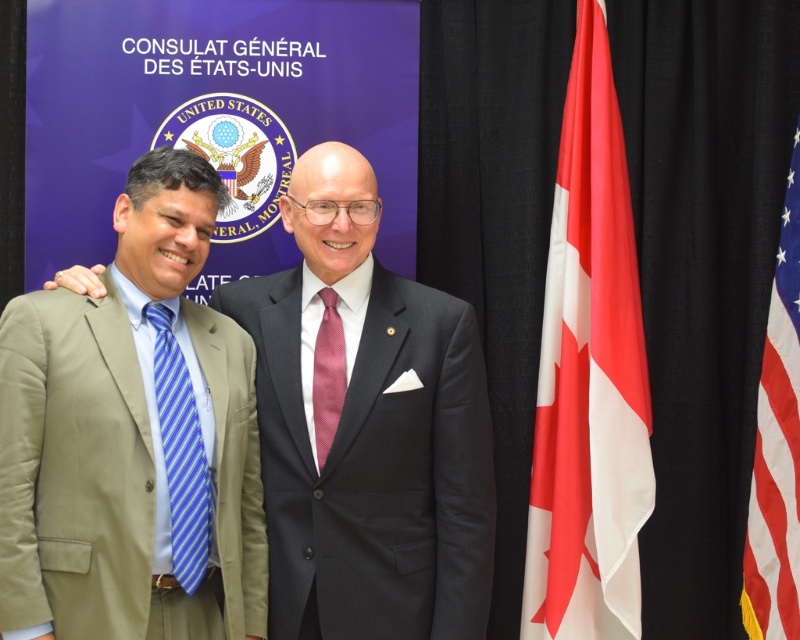
Does black wool suit at center appear over red-white striped fabric at right?

No.

Can you confirm if black wool suit at center is positioned below red-white striped fabric at right?

Indeed, black wool suit at center is positioned under red-white striped fabric at right.

Is point (376, 388) positioned after point (758, 461)?

No, (376, 388) is closer to viewer.

Identify the location of black wool suit at center. (376, 467).

Between black wool suit at center and blue striped tie at left, which one appears on the right side from the viewer's perspective?

black wool suit at center is more to the right.

Does black wool suit at center have a greater height compared to blue striped tie at left?

Yes, black wool suit at center is taller than blue striped tie at left.

Who is more forward, (x=404, y=435) or (x=180, y=461)?

Point (x=180, y=461) is in front.

Identify the location of black wool suit at center. The width and height of the screenshot is (800, 640). (376, 467).

Can you confirm if white fabric flag at right is thinner than blue striped tie at left?

In fact, white fabric flag at right might be wider than blue striped tie at left.

Is white fabric flag at right taller than blue striped tie at left?

Indeed, white fabric flag at right has a greater height compared to blue striped tie at left.

Who is more forward, (616, 125) or (170, 515)?

Positioned in front is point (170, 515).

Where is `white fabric flag at right`? The width and height of the screenshot is (800, 640). white fabric flag at right is located at coordinates (590, 376).